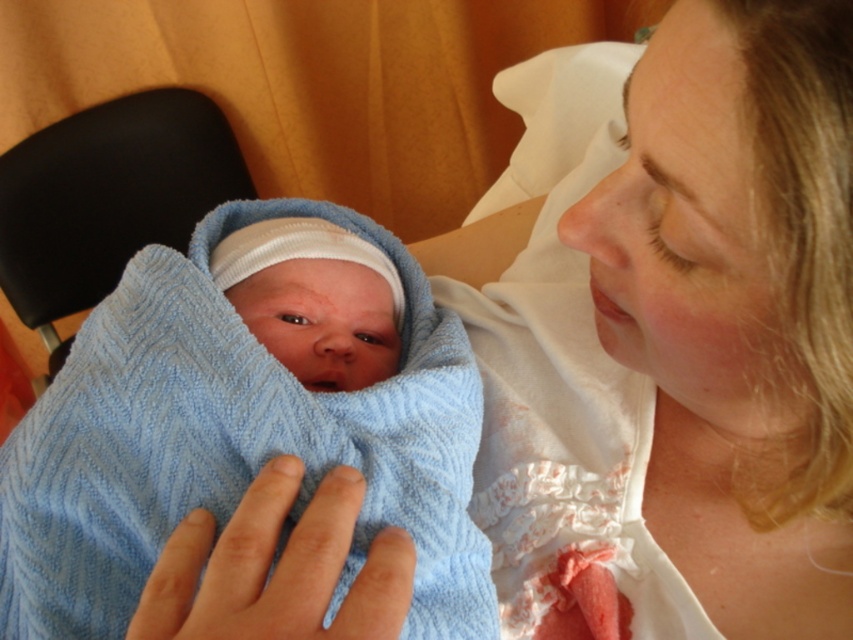
Who is higher up, white knit cap at center or light blue knitted blanket at center?

white knit cap at center is above.

Who is more distant from viewer, (306, 241) or (134, 518)?

Positioned behind is point (306, 241).

Find the location of `white knit cap at center`. white knit cap at center is located at coordinates (314, 300).